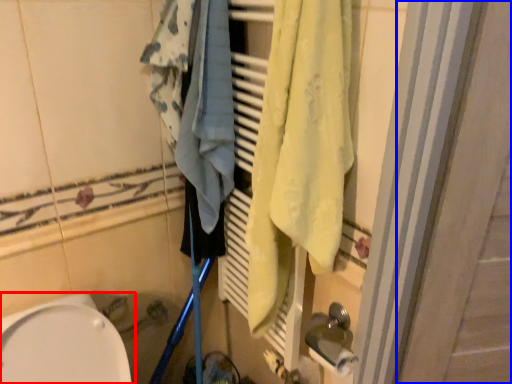
Question: Which point is further to the camera, toilet (highlighted by a red box) or screen door (highlighted by a blue box)?

Choices:
 (A) toilet
 (B) screen door

Answer: (B)